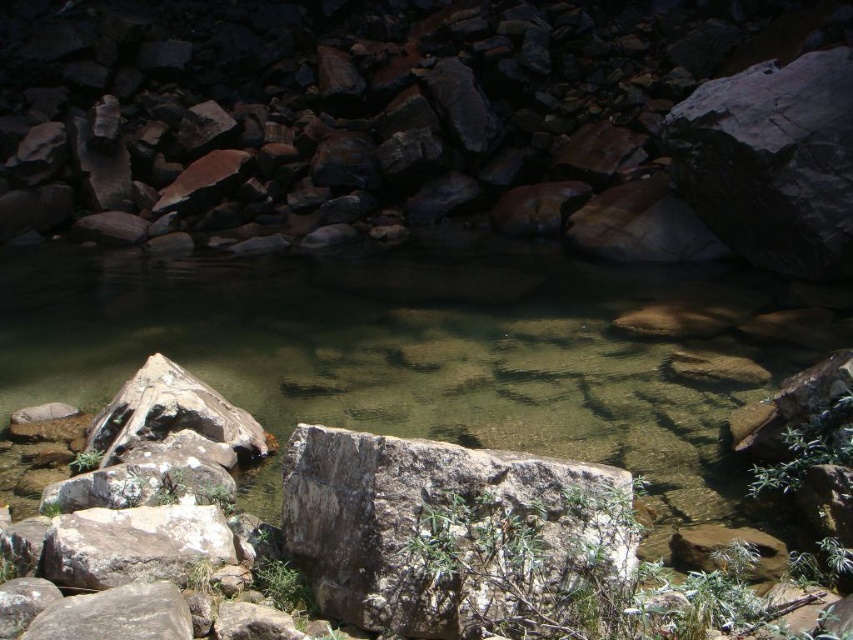
Question: Can you confirm if clear stone stream at center is positioned above gray rough rock at center?

Choices:
 (A) yes
 (B) no

Answer: (A)

Question: Is clear stone stream at center to the right of gray rough rock at center from the viewer's perspective?

Choices:
 (A) no
 (B) yes

Answer: (A)

Question: Among these objects, which one is nearest to the camera?

Choices:
 (A) clear stone stream at center
 (B) gray rough rock at center

Answer: (B)

Question: Is clear stone stream at center positioned at the back of gray rough rock at center?

Choices:
 (A) no
 (B) yes

Answer: (B)